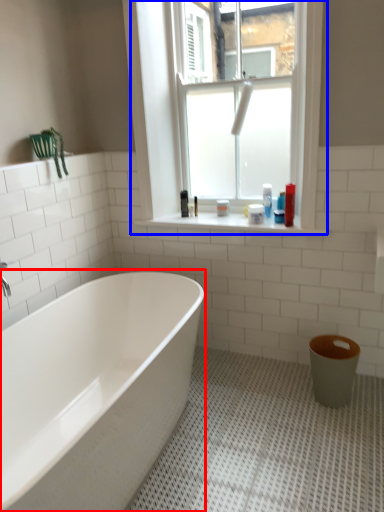
Question: Which object appears farthest to the camera in this image, bathtub (highlighted by a red box) or window (highlighted by a blue box)?

Choices:
 (A) bathtub
 (B) window

Answer: (B)